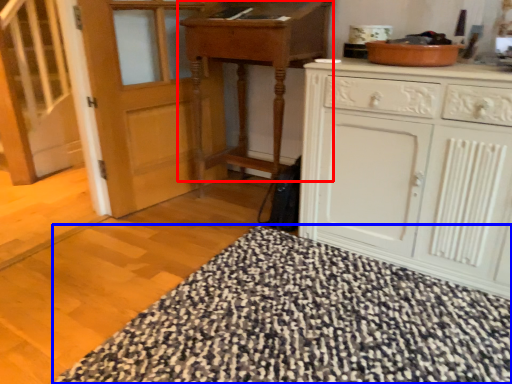
Question: Which of the following is the farthest to the observer, table (highlighted by a red box) or blanket (highlighted by a blue box)?

Choices:
 (A) table
 (B) blanket

Answer: (A)